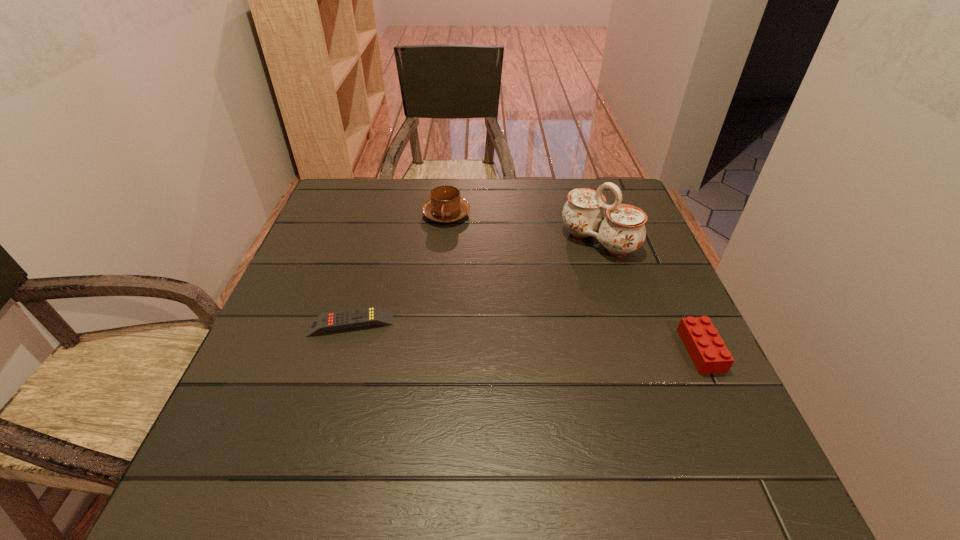
The width and height of the screenshot is (960, 540). In order to click on vacant area located on the side of the cappuccino with the handle in this screenshot , I will do `click(473, 286)`.

The height and width of the screenshot is (540, 960). In order to click on blank area located on the side of the cappuccino with the handle in this screenshot , I will do (460, 250).

The width and height of the screenshot is (960, 540). In order to click on vacant space located 0.250m on the side of the cappuccino with the handle in this screenshot , I will do `click(474, 289)`.

Find the location of a particular element. The height and width of the screenshot is (540, 960). free location located 0.190m by the handle of the chinaware is located at coordinates (532, 296).

Locate an element on the screen. free space located by the handle of the chinaware is located at coordinates (537, 292).

At what (x,y) coordinates should I click in order to perform the action: click on vacant space positioned by the handle of the chinaware. Please return your answer as a coordinate pair (x, y). The height and width of the screenshot is (540, 960). Looking at the image, I should click on (509, 315).

This screenshot has height=540, width=960. In order to click on cappuccino that is at the far edge in this screenshot , I will do `click(445, 206)`.

The height and width of the screenshot is (540, 960). What are the coordinates of `chinaware at the far edge` in the screenshot? It's located at tap(622, 231).

What are the coordinates of `object that is at the left edge` in the screenshot? It's located at (331, 321).

Identify the location of Lego that is at the right edge. Image resolution: width=960 pixels, height=540 pixels. (709, 354).